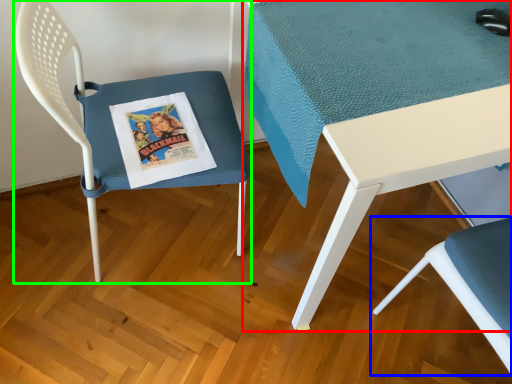
Question: Estimate the real-world distances between objects in this image. Which object is closer to table (highlighted by a red box), chair (highlighted by a blue box) or chair (highlighted by a green box)?

Choices:
 (A) chair
 (B) chair

Answer: (B)